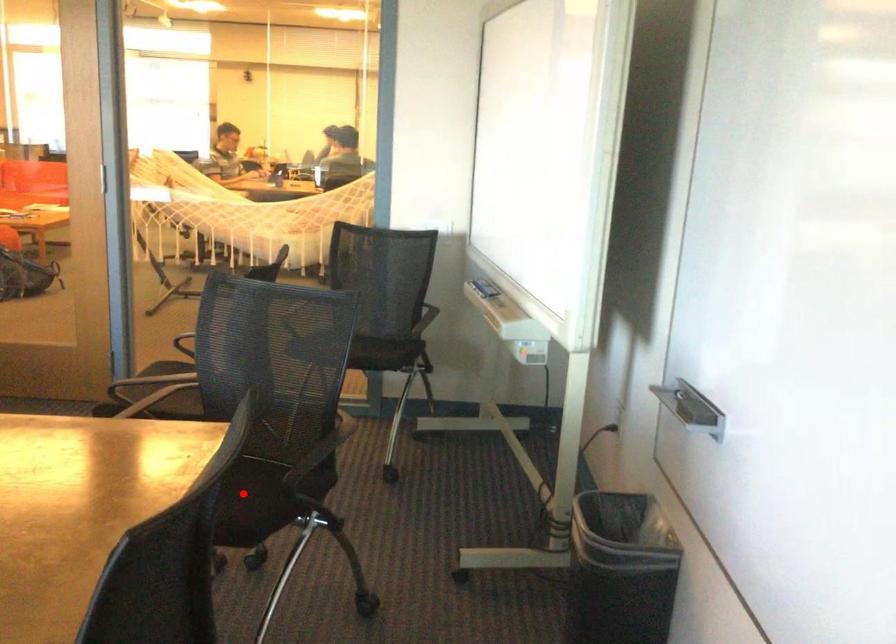
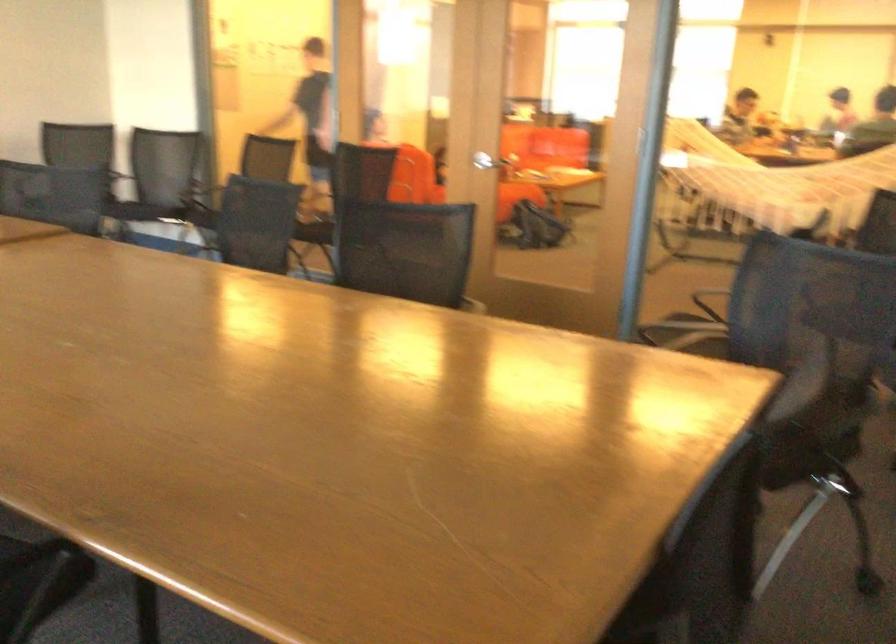
Question: I am providing you with two images of the same scene from different viewpoints. A red point is marked on the first image. At the location where the point appears in image 1, is it still visible in image 2?

Choices:
 (A) Yes
 (B) No

Answer: (B)